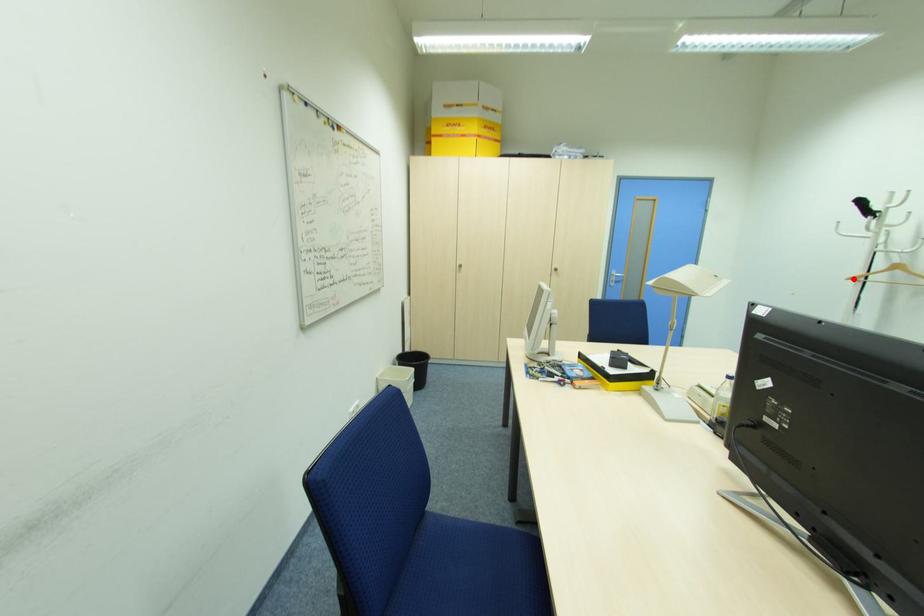
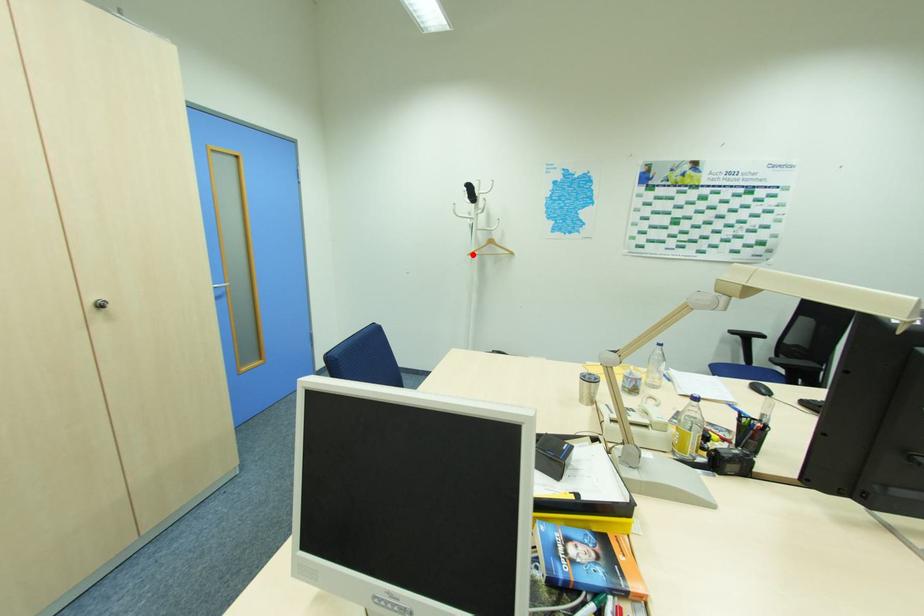
I am providing you with two images of the same scene from different viewpoints. A red point is marked on the first image and another point is marked on the second image. Do the highlighted points in image1 and image2 indicate the same real-world spot?

Yes